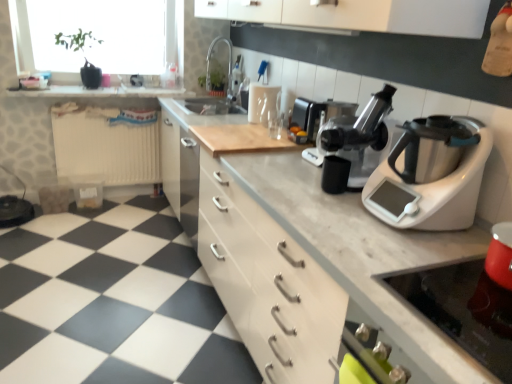
Locate an element on the screen. white plastic radiator at lower left is located at coordinates (106, 144).

The image size is (512, 384). Describe the element at coordinates (106, 144) in the screenshot. I see `white plastic radiator at lower left` at that location.

Find the location of a particular element. transparent glass window screen at upper left is located at coordinates (95, 35).

You are a GUI agent. You are given a task and a screenshot of the screen. Output one action in this format:
    pyautogui.click(x=<x>, y=<y>)
    Task: Click on the sleek silver coffee machine at center
    The image size is (512, 384).
    Given the screenshot: What is the action you would take?
    pyautogui.click(x=336, y=111)

In order to face black plastic juicer at center, should I rotate leftwards or rightwards?

To align with it, rotate right about 13.417°.

Identify the location of white marble cutting board at upper center. (96, 92).

In order to face white marble cutting board at upper center, should I rotate leftwards or rightwards?

A 19.412 degree turn to the left will do.

The image size is (512, 384). In order to click on white plastic radiator at lower left in this screenshot , I will do `click(106, 144)`.

Is point (176, 94) closer or farther from the camera than point (465, 192)?

Point (176, 94) appears to be farther away from the viewer than point (465, 192).

How different are the orientations of white marble cutting board at upper center and silver metallic food processor at right in degrees?

The facing directions of white marble cutting board at upper center and silver metallic food processor at right are 90.2 degrees apart.

From the image's perspective, does white marble cutting board at upper center appear lower than silver metallic food processor at right?

No, from the image's perspective, white marble cutting board at upper center is not beneath silver metallic food processor at right.

Is sleek silver coffee machine at center surrounded by white plastic radiator at lower left?

Actually, sleek silver coffee machine at center is outside white plastic radiator at lower left.

The height and width of the screenshot is (384, 512). Find the location of `radiator behind the sleek silver coffee machine at center`. radiator behind the sleek silver coffee machine at center is located at coordinates (106, 144).

From their relative heights in the image, would you say white plastic radiator at lower left is taller or shorter than sleek silver coffee machine at center?

Clearly, white plastic radiator at lower left is taller compared to sleek silver coffee machine at center.

Are white plastic radiator at lower left and sleek silver coffee machine at center far apart?

That's right, there is a large distance between white plastic radiator at lower left and sleek silver coffee machine at center.

Considering the relative sizes of silver metallic food processor at right and white marble countertop at center in the image provided, is silver metallic food processor at right smaller than white marble countertop at center?

Correct, silver metallic food processor at right occupies less space than white marble countertop at center.

Which point is more distant from viewer, (x=450, y=228) or (x=373, y=285)?

The point (x=450, y=228) is farther from the camera.

Which object is closer to the camera taking this photo, silver metallic food processor at right or white marble countertop at center?

white marble countertop at center is more forward.

I want to click on coffee machine to the left of silver metallic food processor at right, so click(336, 111).

Based on the photo, which is correct: silver metallic food processor at right is inside sleek silver coffee machine at center, or outside of it?

silver metallic food processor at right exists outside the volume of sleek silver coffee machine at center.

Is silver metallic food processor at right wider or thinner than sleek silver coffee machine at center?

Clearly, silver metallic food processor at right has more width compared to sleek silver coffee machine at center.

Consider the image. Does white plastic radiator at lower left have a smaller size compared to transparent glass window screen at upper left?

Yes, white plastic radiator at lower left is smaller than transparent glass window screen at upper left.

Is white plastic radiator at lower left turned away from transparent glass window screen at upper left?

No, white plastic radiator at lower left is not facing the opposite direction of transparent glass window screen at upper left.

In the scene shown: Can transparent glass window screen at upper left be found inside white plastic radiator at lower left?

No, transparent glass window screen at upper left is not surrounded by white plastic radiator at lower left.

Which object is positioned more to the right, metallic silver gas stove at lower right or white plastic radiator at lower left?

From the viewer's perspective, metallic silver gas stove at lower right appears more on the right side.

Could you measure the distance between metallic silver gas stove at lower right and white plastic radiator at lower left?

metallic silver gas stove at lower right is 9.05 feet away from white plastic radiator at lower left.

Considering the relative sizes of metallic silver gas stove at lower right and white plastic radiator at lower left in the image provided, is metallic silver gas stove at lower right bigger than white plastic radiator at lower left?

Incorrect, metallic silver gas stove at lower right is not larger than white plastic radiator at lower left.

From a real-world perspective, who is located higher, metallic silver gas stove at lower right or white plastic radiator at lower left?

metallic silver gas stove at lower right is physically above.

From the image's perspective, is white marble countertop at center under black plastic juicer at center?

Yes, from the image's perspective, white marble countertop at center is below black plastic juicer at center.

Is white marble countertop at center looking in the opposite direction of black plastic juicer at center?

No, black plastic juicer at center is not at the back of white marble countertop at center.

Which of these two, white marble countertop at center or black plastic juicer at center, is thinner?

black plastic juicer at center.

Considering the positions of objects white marble countertop at center and black plastic juicer at center in the image provided, who is in front, white marble countertop at center or black plastic juicer at center?

white marble countertop at center is closer to the camera.

Image resolution: width=512 pixels, height=384 pixels. I want to click on counter top behind the silver metallic food processor at right, so click(96, 92).

This screenshot has height=384, width=512. I want to click on coffee machine in front of the white plastic radiator at lower left, so click(x=336, y=111).

Considering their positions, is white marble countertop at center positioned further to black plastic juicer at center than white marble cutting board at upper center?

white marble cutting board at upper center.

When comparing their distances from sleek silver coffee machine at center, does transparent glass window screen at upper left or white marble cutting board at upper center seem closer?

Based on the image, white marble cutting board at upper center appears to be nearer to sleek silver coffee machine at center.

Which object lies nearer to the anchor point white marble cutting board at upper center, matte silver sink at upper center or metallic silver gas stove at lower right?

Among the two, matte silver sink at upper center is located nearer to white marble cutting board at upper center.

Estimate the real-world distances between objects in this image. Which object is closer to silver metallic food processor at right, white marble countertop at center or sleek silver coffee machine at center?

The object closer to silver metallic food processor at right is white marble countertop at center.

When comparing their distances from white marble countertop at center, does matte silver sink at upper center or sleek silver coffee machine at center seem further?

Based on the image, matte silver sink at upper center appears to be further to white marble countertop at center.

From the image, which object appears to be farther from silver metallic food processor at right, black plastic juicer at center or metallic silver gas stove at lower right?

Among the two, metallic silver gas stove at lower right is located further to silver metallic food processor at right.

Estimate the real-world distances between objects in this image. Which object is further from white marble countertop at center, transparent glass window screen at upper left or silver metallic food processor at right?

transparent glass window screen at upper left is positioned further to the anchor white marble countertop at center.

When comparing their distances from metallic silver gas stove at lower right, does sleek silver coffee machine at center or black plastic juicer at center seem closer?

Among the two, black plastic juicer at center is located nearer to metallic silver gas stove at lower right.

At what (x,y) coordinates should I click in order to perform the action: click on sink between silver metallic food processor at right and white plastic radiator at lower left along the z-axis. Please return your answer as a coordinate pair (x, y). Looking at the image, I should click on pos(216,86).

Identify the location of sink positioned between white marble countertop at center and white plastic radiator at lower left from near to far. This screenshot has width=512, height=384. (216, 86).

The width and height of the screenshot is (512, 384). I want to click on sink situated between transparent glass window screen at upper left and sleek silver coffee machine at center from left to right, so click(x=216, y=86).

Where is `window screen between metallic silver gas stove at lower right and white plastic radiator at lower left in the front-back direction`? The image size is (512, 384). window screen between metallic silver gas stove at lower right and white plastic radiator at lower left in the front-back direction is located at coordinates tap(95, 35).